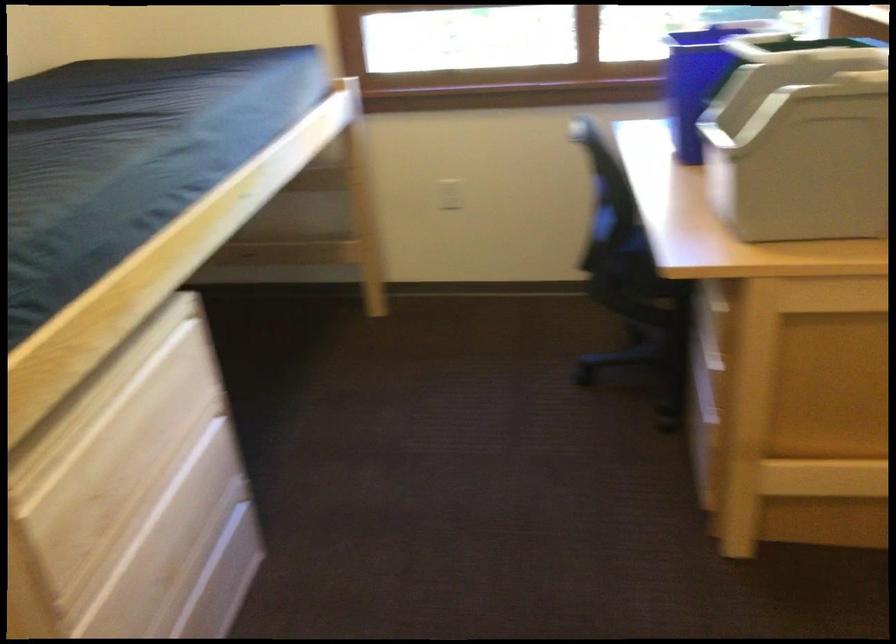
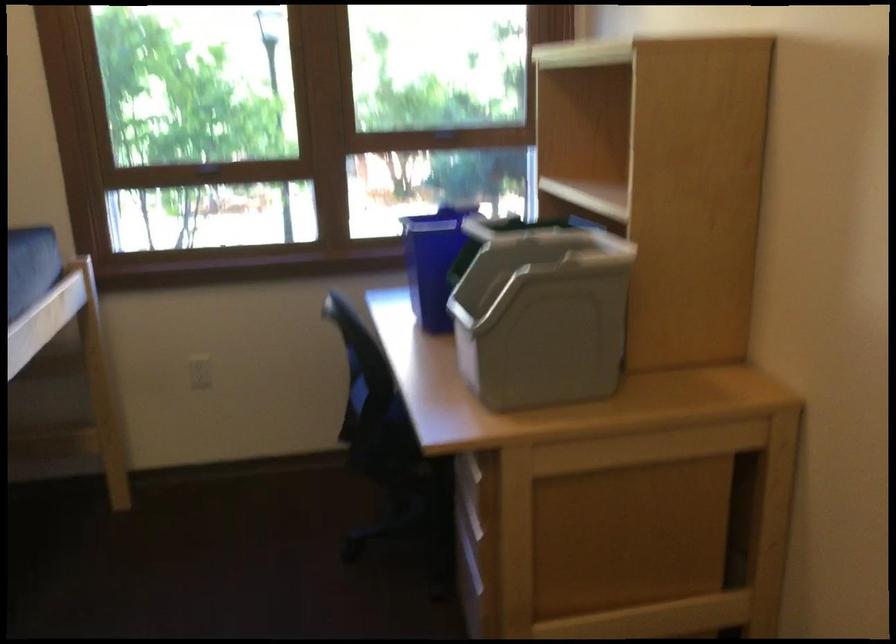
Where in the second image is the point corresponding to pixel 821 136 from the first image?

(540, 313)